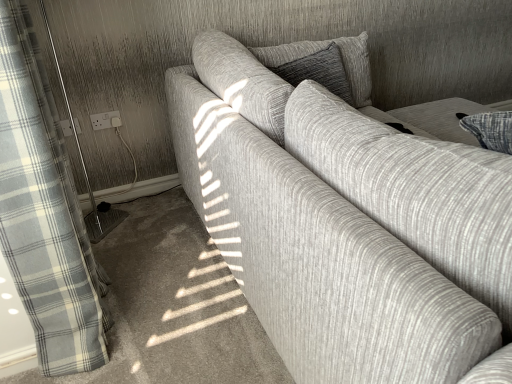
In order to face white textured screen door at left, should I rotate leftwards or rightwards?

You should rotate left by 23.502 degrees.

The height and width of the screenshot is (384, 512). What are the coordinates of `textured gray couch at center` in the screenshot? It's located at (345, 219).

What do you see at coordinates (44, 214) in the screenshot?
I see `white checkered fabric at left` at bounding box center [44, 214].

The width and height of the screenshot is (512, 384). What are the coordinates of `white textured screen door at left` in the screenshot? It's located at (97, 208).

How far apart are textured gray couch at center and textured gray pillow at center?

A distance of 79.70 centimeters exists between textured gray couch at center and textured gray pillow at center.

Is textured gray couch at center behind textured gray pillow at center?

No.

Considering the relative sizes of textured gray couch at center and textured gray pillow at center in the image provided, is textured gray couch at center wider than textured gray pillow at center?

Yes.

From the picture: Is textured gray couch at center facing towards textured gray pillow at center?

Yes.

Is white checkered fabric at left inside or outside of textured gray pillow at center?

The correct answer is: outside.

Does white checkered fabric at left turn towards textured gray pillow at center?

Yes.

What's the angular difference between white checkered fabric at left and textured gray pillow at center's facing directions?

The angular difference between white checkered fabric at left and textured gray pillow at center is 84.9 degrees.

From the image's perspective, is white checkered fabric at left above white plastic socket at lower left, the first electric outlet when ordered from left to right?

Actually, white checkered fabric at left appears below white plastic socket at lower left, the first electric outlet when ordered from left to right, in the image.

Does point (34, 80) appear closer or farther from the camera than point (65, 120)?

Point (34, 80) is positioned closer to the camera compared to point (65, 120).

Between white plastic socket at upper left, which appears as the first electric outlet when viewed from the right, and white textured screen door at left, which one has more height?

white textured screen door at left is taller.

Is white plastic socket at upper left, which appears as the first electric outlet when viewed from the right, with white textured screen door at left?

There is a gap between white plastic socket at upper left, which appears as the first electric outlet when viewed from the right, and white textured screen door at left.

From a real-world perspective, is white plastic socket at upper left, acting as the second electric outlet starting from the left, over white textured screen door at left?

No, from a real-world perspective, white plastic socket at upper left, acting as the second electric outlet starting from the left, is not over white textured screen door at left

Is white plastic socket at upper left, acting as the second electric outlet starting from the left, inside or outside of textured gray pillow at center?

white plastic socket at upper left, acting as the second electric outlet starting from the left, exists outside the volume of textured gray pillow at center.

Is white plastic socket at upper left, which appears as the first electric outlet when viewed from the right, oriented away from textured gray pillow at center?

No, white plastic socket at upper left, which appears as the first electric outlet when viewed from the right,'s orientation is not away from textured gray pillow at center.

Is white plastic socket at upper left, which appears as the first electric outlet when viewed from the right, positioned far away from textured gray pillow at center?

Indeed, white plastic socket at upper left, which appears as the first electric outlet when viewed from the right, is not near textured gray pillow at center.

Is white plastic socket at lower left, which is counted as the 2th electric outlet, starting from the right, to the right of white textured screen door at left from the viewer's perspective?

No.

Considering the relative sizes of white plastic socket at lower left, which is counted as the 2th electric outlet, starting from the right, and white textured screen door at left in the image provided, is white plastic socket at lower left, which is counted as the 2th electric outlet, starting from the right, shorter than white textured screen door at left?

Indeed, white plastic socket at lower left, which is counted as the 2th electric outlet, starting from the right, has a lesser height compared to white textured screen door at left.

Is white plastic socket at lower left, the first electric outlet when ordered from left to right, located outside white textured screen door at left?

No, most part of white plastic socket at lower left, the first electric outlet when ordered from left to right, lies within white textured screen door at left.

From their relative heights in the image, would you say white plastic socket at lower left, the first electric outlet when ordered from left to right, is taller or shorter than white plastic socket at upper left, which appears as the first electric outlet when viewed from the right?

white plastic socket at lower left, the first electric outlet when ordered from left to right, is shorter than white plastic socket at upper left, which appears as the first electric outlet when viewed from the right.

From the image's perspective, between white plastic socket at lower left, which is counted as the 2th electric outlet, starting from the right, and white plastic socket at upper left, which appears as the first electric outlet when viewed from the right, which one is located above?

From the image's view, white plastic socket at upper left, which appears as the first electric outlet when viewed from the right, is above.

How much distance is there between white plastic socket at lower left, the first electric outlet when ordered from left to right, and white plastic socket at upper left, which appears as the first electric outlet when viewed from the right?

They are 4.82 inches apart.

Is white plastic socket at lower left, the first electric outlet when ordered from left to right, next to white plastic socket at upper left, which appears as the first electric outlet when viewed from the right, and touching it?

white plastic socket at lower left, the first electric outlet when ordered from left to right, is not next to white plastic socket at upper left, which appears as the first electric outlet when viewed from the right, and they're not touching.

Image resolution: width=512 pixels, height=384 pixels. I want to click on studio couch on the right of textured gray pillow at center, so point(345,219).

This screenshot has height=384, width=512. I want to click on curtain below the textured gray pillow at center (from the image's perspective), so click(44, 214).

Considering their positions, is white checkered fabric at left positioned further to textured gray pillow at center than white textured screen door at left?

Among the two, white textured screen door at left is located further to textured gray pillow at center.

Estimate the real-world distances between objects in this image. Which object is closer to textured gray couch at center, white plastic socket at lower left, which is counted as the 2th electric outlet, starting from the right, or textured gray pillow at center?

Among the two, textured gray pillow at center is located nearer to textured gray couch at center.

Which object lies nearer to the anchor point white textured screen door at left, textured gray pillow at center or white plastic socket at upper left, which appears as the first electric outlet when viewed from the right?

Among the two, white plastic socket at upper left, which appears as the first electric outlet when viewed from the right, is located nearer to white textured screen door at left.

When comparing their distances from white plastic socket at upper left, which appears as the first electric outlet when viewed from the right, does textured gray pillow at center or textured gray couch at center seem closer?

textured gray pillow at center.

When comparing their distances from white plastic socket at lower left, the first electric outlet when ordered from left to right, does white checkered fabric at left or textured gray pillow at center seem closer?

Based on the image, white checkered fabric at left appears to be nearer to white plastic socket at lower left, the first electric outlet when ordered from left to right.

Looking at the image, which one is located closer to white textured screen door at left, textured gray pillow at center or white checkered fabric at left?

Based on the image, white checkered fabric at left appears to be nearer to white textured screen door at left.

Based on their spatial positions, is white plastic socket at lower left, which is counted as the 2th electric outlet, starting from the right, or textured gray pillow at center further from white textured screen door at left?

Based on the image, textured gray pillow at center appears to be further to white textured screen door at left.

Based on their spatial positions, is white plastic socket at lower left, the first electric outlet when ordered from left to right, or white plastic socket at upper left, acting as the second electric outlet starting from the left, further from white checkered fabric at left?

Based on the image, white plastic socket at upper left, acting as the second electric outlet starting from the left, appears to be further to white checkered fabric at left.

Find the location of a particular element. pillow between textured gray couch at center and white plastic socket at upper left, acting as the second electric outlet starting from the left, from front to back is located at coordinates (325, 47).

This screenshot has height=384, width=512. In order to click on pillow between textured gray couch at center and white plastic socket at lower left, the first electric outlet when ordered from left to right, along the z-axis in this screenshot , I will do `click(325, 47)`.

I want to click on electric outlet situated between white textured screen door at left and textured gray pillow at center from left to right, so click(103, 120).

Identify the location of screen door located between textured gray couch at center and white plastic socket at upper left, which appears as the first electric outlet when viewed from the right, in the depth direction. The width and height of the screenshot is (512, 384). (97, 208).